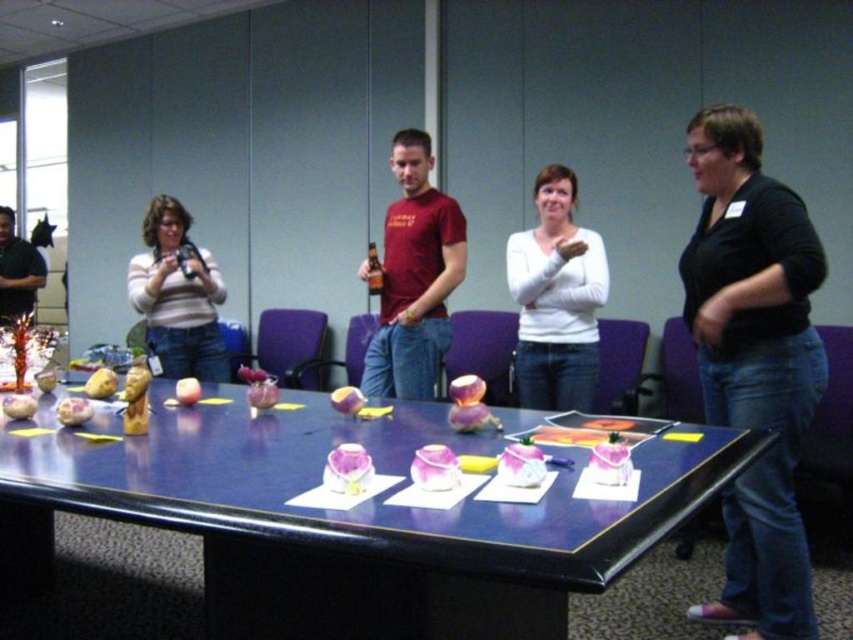
Question: Which point is farther to the camera?

Choices:
 (A) (393, 296)
 (B) (183, 378)
 (C) (265, 493)
 (D) (196, 339)

Answer: (B)

Question: Is the position of striped sweater at center more distant than that of shiny red apple at center?

Choices:
 (A) no
 (B) yes

Answer: (B)

Question: Among these objects, which one is nearest to the camera?

Choices:
 (A) matte red t-shirt at center
 (B) white matte sweater at center
 (C) brushed metal water at bottle left

Answer: (B)

Question: Does black matte shirt at center appear on the right side of red matte apple at center?

Choices:
 (A) yes
 (B) no

Answer: (A)

Question: Among these objects, which one is farthest from the camera?

Choices:
 (A) striped sweater at center
 (B) white matte sweater at center
 (C) brushed metal water at bottle left

Answer: (C)

Question: Is purple glossy table at center wider than white matte sweater at center?

Choices:
 (A) no
 (B) yes

Answer: (B)